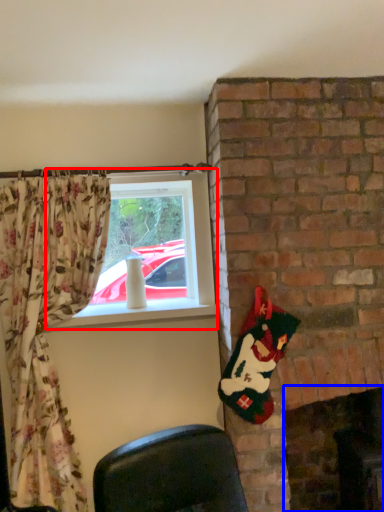
Question: Which object appears farthest to the camera in this image, window (highlighted by a red box) or fireplace (highlighted by a blue box)?

Choices:
 (A) window
 (B) fireplace

Answer: (A)